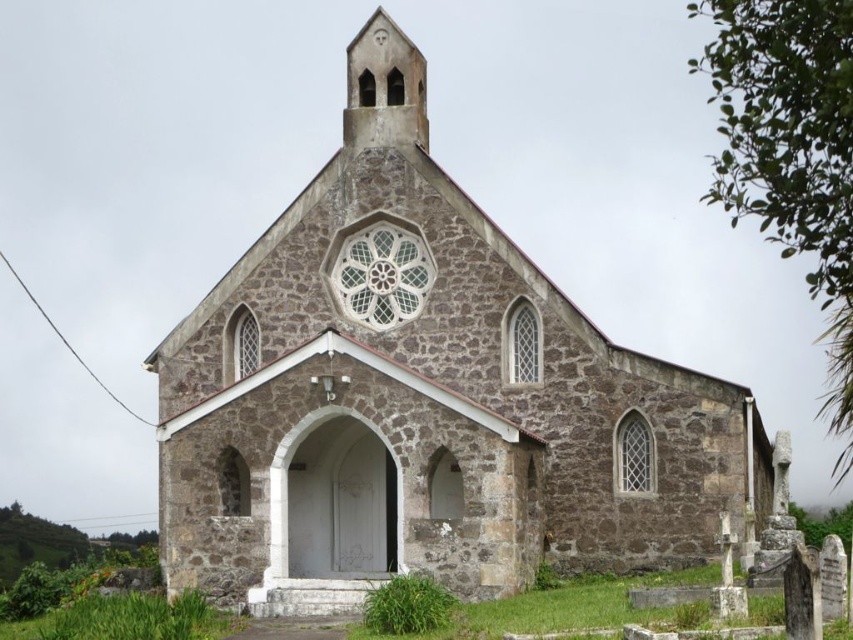
Between brown stone church at center and smooth stone spire at upper center, which one appears on the right side from the viewer's perspective?

brown stone church at center

Looking at this image, does brown stone church at center have a greater height compared to smooth stone spire at upper center?

Correct, brown stone church at center is much taller as smooth stone spire at upper center.

Measure the distance between point (352, 566) and camera.

The distance of point (352, 566) from camera is 82.52 meters.

This screenshot has width=853, height=640. Find the location of `brown stone church at center`. brown stone church at center is located at coordinates (424, 412).